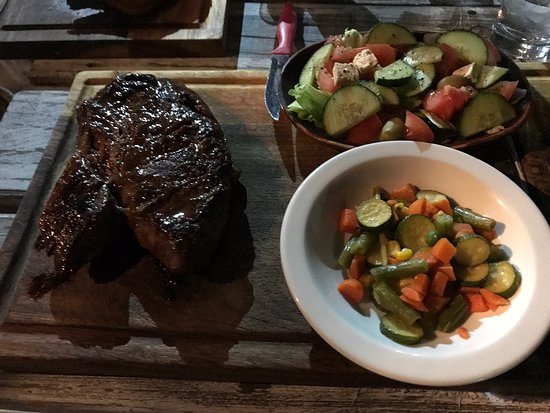
In order to click on knife handle in this screenshot , I will do `click(284, 29)`.